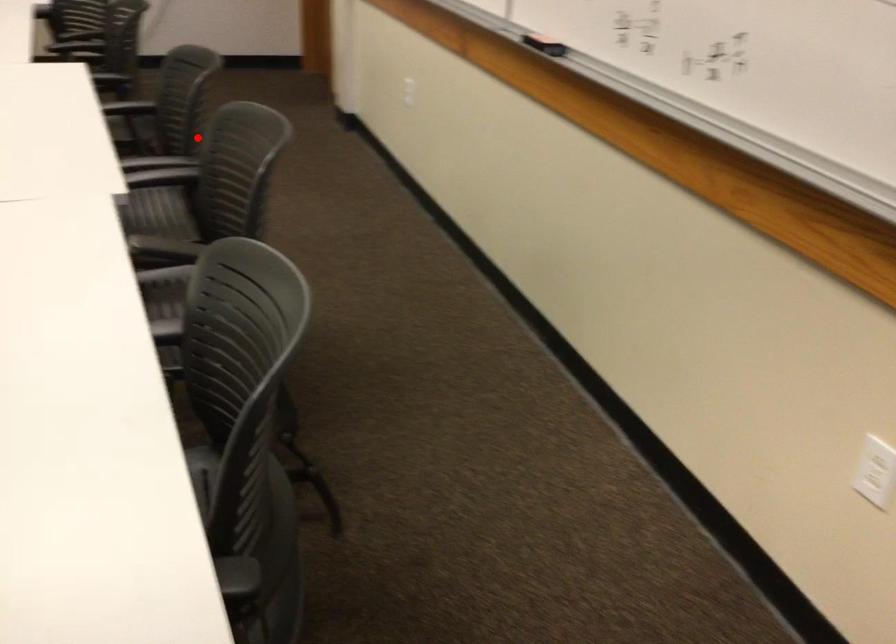
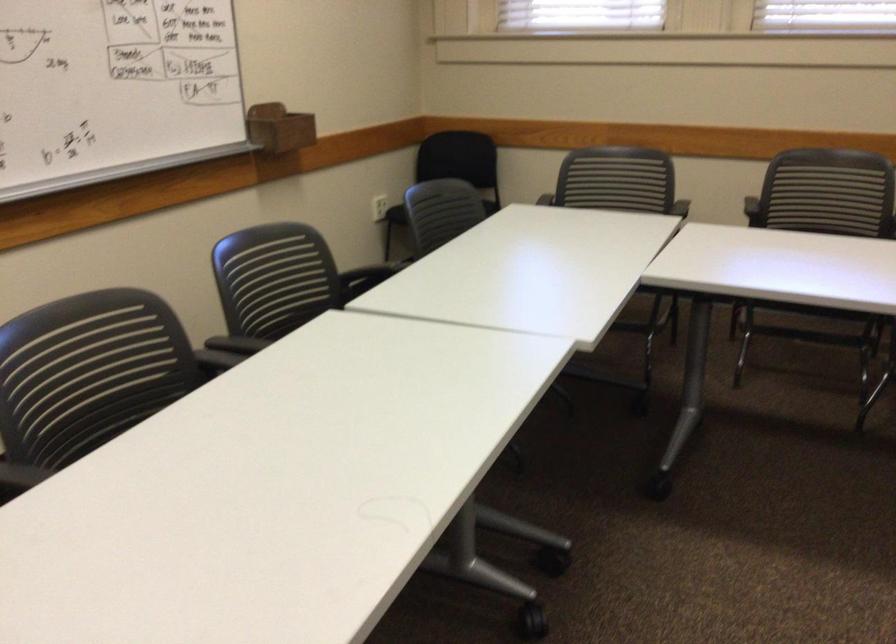
Question: I am providing you with two images of the same scene from different viewpoints. Image1 has a red point marked. In image2, the corresponding 3D location appears at what relative position? Reply with the corresponding letter.

Choices:
 (A) Closer
 (B) Farther

Answer: (A)